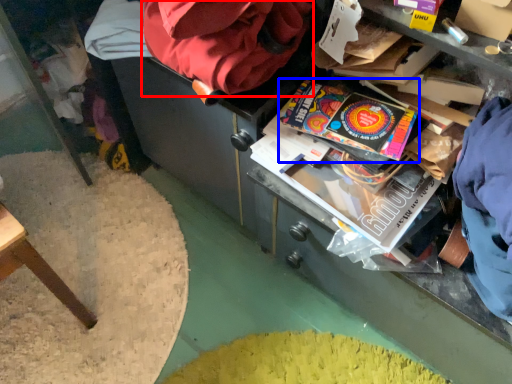
Question: Among these objects, which one is farthest to the camera, bean bag chair (highlighted by a red box) or paperback book (highlighted by a blue box)?

Choices:
 (A) bean bag chair
 (B) paperback book

Answer: (B)